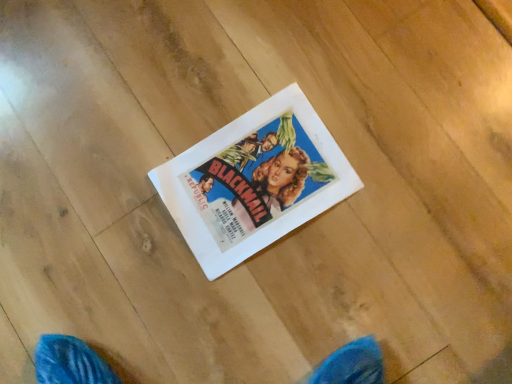
Find the location of a particular element. white paper at center is located at coordinates (254, 181).

The width and height of the screenshot is (512, 384). Describe the element at coordinates (254, 181) in the screenshot. I see `white paper at center` at that location.

This screenshot has height=384, width=512. I want to click on white paper at center, so click(x=254, y=181).